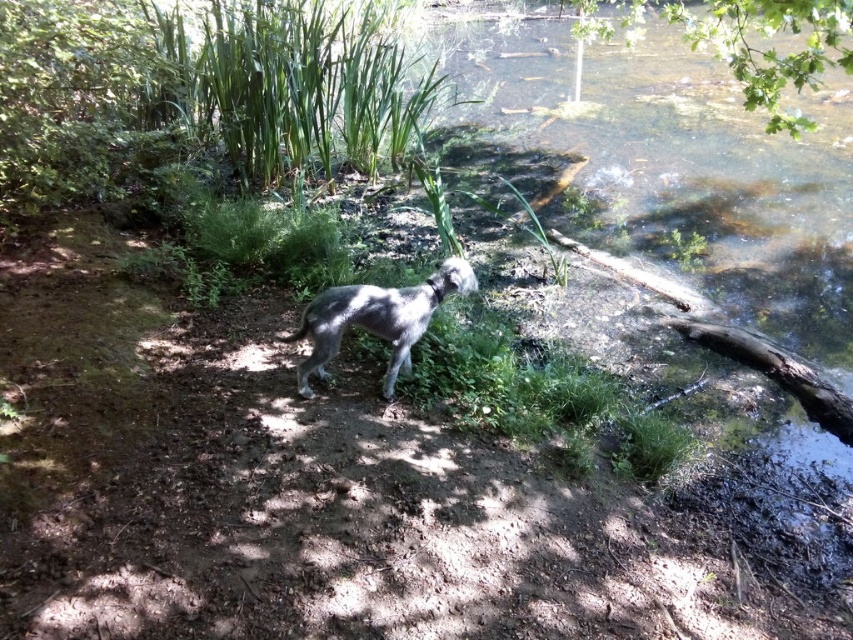
You are a bird flying over the serene natural setting. You want to land on the green leafy tree at upper right. What are the coordinates of the tree to guide your landing?

The green leafy tree at upper right is located at coordinates point (749, 42).